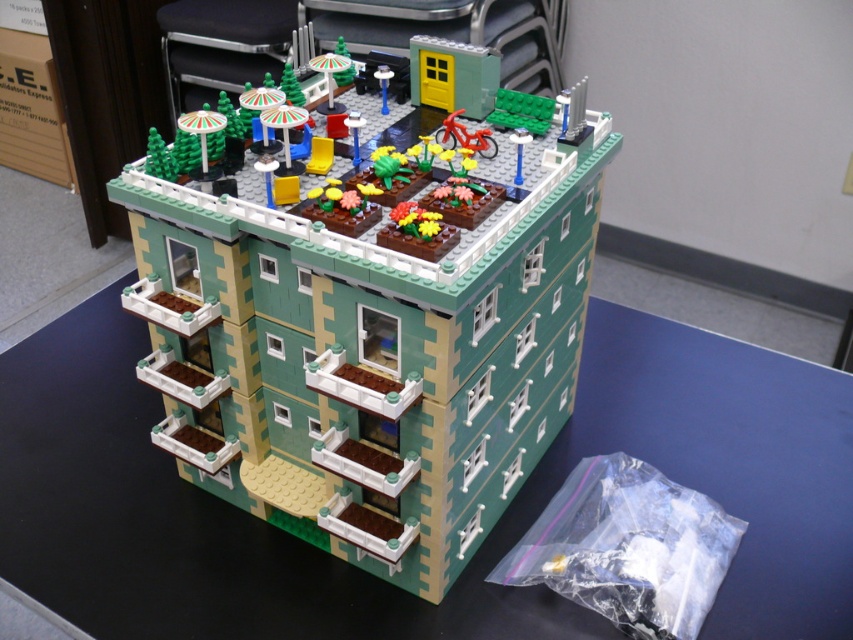
Which is below, green matte building at center or green plastic table at center?

green plastic table at center is lower down.

The width and height of the screenshot is (853, 640). In order to click on green matte building at center in this screenshot , I will do `click(372, 336)`.

Describe the element at coordinates (372, 336) in the screenshot. I see `green matte building at center` at that location.

The width and height of the screenshot is (853, 640). Identify the location of green matte building at center. (372, 336).